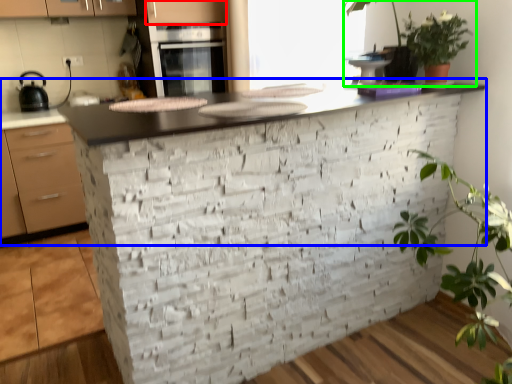
Question: Based on their relative distances, which object is nearer to cabinetry (highlighted by a red box)? Choose from countertop (highlighted by a blue box) and houseplant (highlighted by a green box).

Choices:
 (A) countertop
 (B) houseplant

Answer: (A)